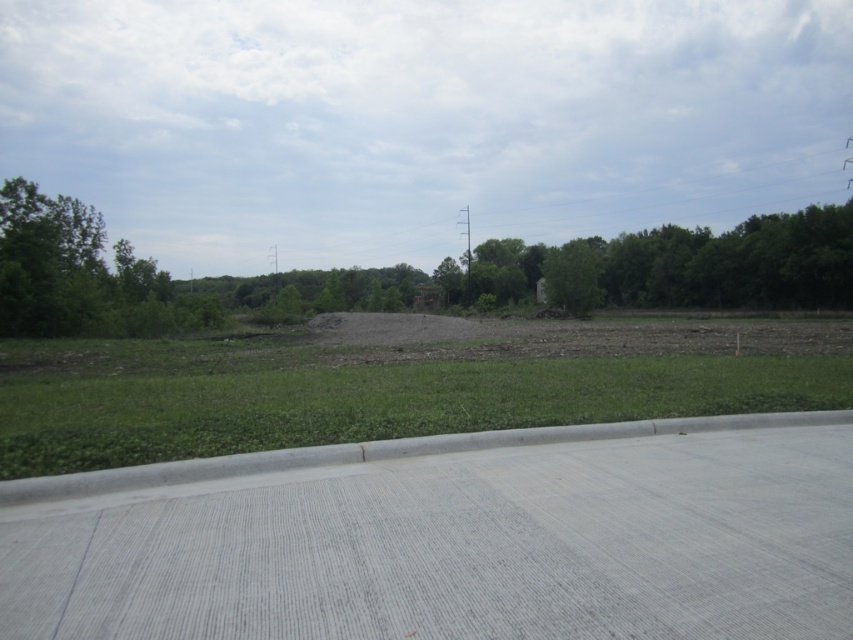
You are standing at the edge of the paved surface and want to reach the green grass at center. The paved surface is 4 meters wide. Can you walk straight ahead without stepping off the paved area?

The distance between you and the green grass at center is 5.26 meters. Since the paved surface is only 4 meters wide, you would need to step onto the grass after 4 meters, so you cannot walk straight ahead without leaving the paved area.

You are standing on the paved surface and want to walk to the barren area. Which direction should you go from the green grass at center to reach the brown soil at center?

To reach the brown soil at center from the green grass at center, you should move to the right since the green grass at center is positioned on the left side of brown soil at center.